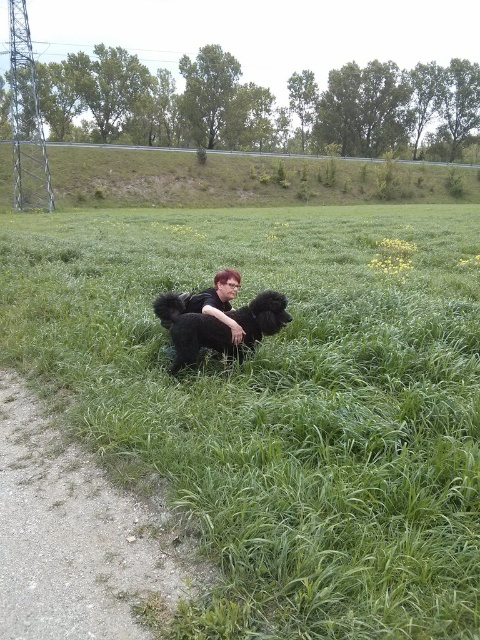
Can you confirm if black fluffy dog at center is taller than shiny black hair at center?

Incorrect, black fluffy dog at center's height is not larger of shiny black hair at center's.

Looking at this image, between black fluffy dog at center and shiny black hair at center, which one is positioned higher?

shiny black hair at center

The height and width of the screenshot is (640, 480). What do you see at coordinates (218, 326) in the screenshot? I see `black fluffy dog at center` at bounding box center [218, 326].

At what (x,y) coordinates should I click in order to perform the action: click on black fluffy dog at center. Please return your answer as a coordinate pair (x, y). Looking at the image, I should click on (218, 326).

Who is more forward, (127, 317) or (197, 339)?

Positioned in front is point (197, 339).

What are the coordinates of `green grassy field at center` in the screenshot? It's located at (279, 404).

Locate an element on the screen. green grassy field at center is located at coordinates (279, 404).

Between green grassy field at center and shiny black hair at center, which one has more height?

green grassy field at center

Who is more forward, (433, 604) or (233, 276)?

Positioned in front is point (433, 604).

Where is `green grassy field at center`? The height and width of the screenshot is (640, 480). green grassy field at center is located at coordinates (279, 404).